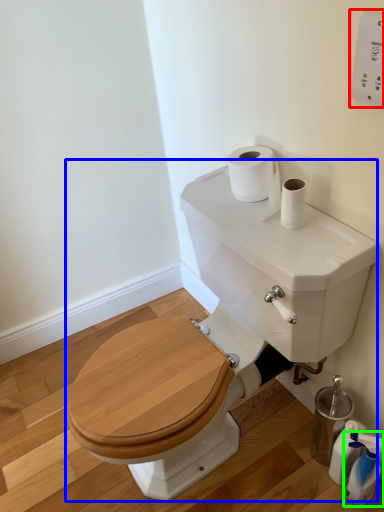
Question: Based on their relative distances, which object is farther from electric outlet (highlighted by a red box)? Choose from sink (highlighted by a blue box) and cleaning product (highlighted by a green box).

Choices:
 (A) sink
 (B) cleaning product

Answer: (B)